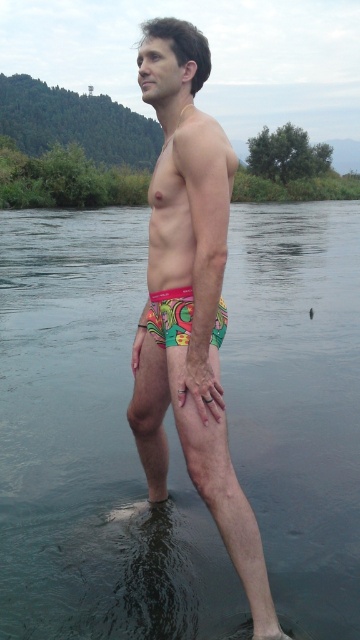
You are a swimmer who wants to cross the river shown in the image. You see the clear water at lower center and the vibrant printed fabric shorts at center. Based on the scene, can you tell which object is higher in the image?

The clear water at lower center is much taller than the vibrant printed fabric shorts at center, so the clear water at lower center is higher in the image.

You are standing on the edge of the water and want to step into the clear water at lower center located at point (92, 451). Which direction should you move to reach it?

The clear water at lower center is located at point (92, 451), so you should move forward or downward from your current position to reach it.

You are a photographer trying to capture the person in the image. You want to focus on the point closer to the camera between the two points labeled as point (141, 88) and point (168, 292). Which point should you focus on?

You should focus on point (141, 88) because it is further to the camera than point (168, 292), making it closer to the photographer.